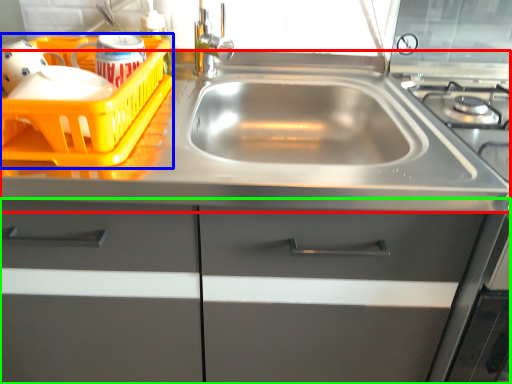
Question: Which object is the farthest from counter top (highlighted by a red box)? Choose among these: basket (highlighted by a blue box) or cabinetry (highlighted by a green box).

Choices:
 (A) basket
 (B) cabinetry

Answer: (B)